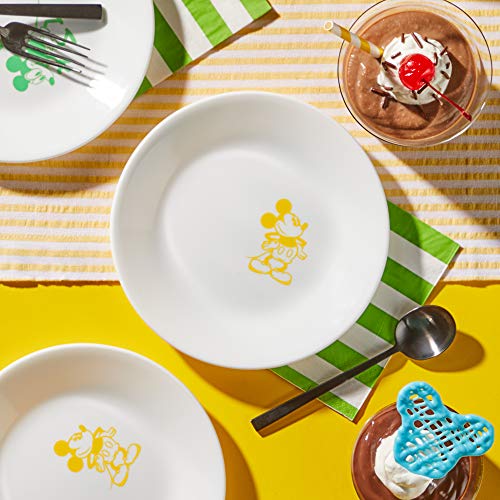
Find the location of `yellow tablecloth`. yellow tablecloth is located at coordinates (87, 319).